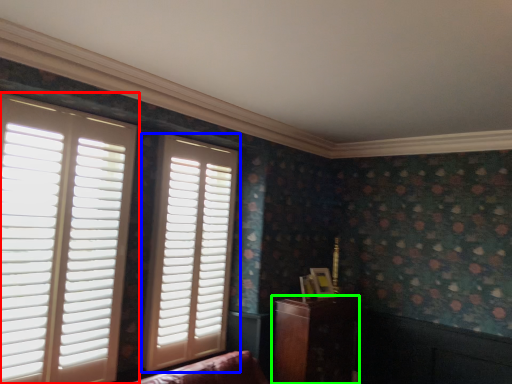
Question: Considering the real-world distances, which object is closest to window (highlighted by a red box)? window (highlighted by a blue box) or furniture (highlighted by a green box).

Choices:
 (A) window
 (B) furniture

Answer: (A)